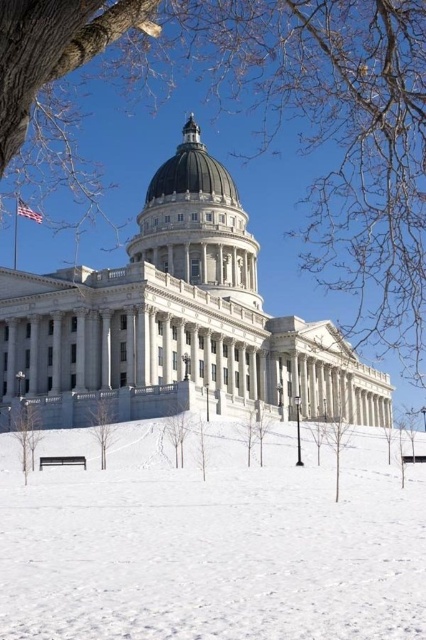
Question: Among these objects, which one is farthest from the camera?

Choices:
 (A) white powdery snow at center
 (B) smooth brown tree at center

Answer: (B)

Question: Can you confirm if green leafy tree at lower left is positioned to the right of smooth brown tree at center?

Choices:
 (A) no
 (B) yes

Answer: (A)

Question: Estimate the real-world distances between objects in this image. Which object is farther from the smooth brown tree at center?

Choices:
 (A) white powdery snow at center
 (B) bare branches at center
 (C) green leafy tree at center
 (D) matte gray dome at center

Answer: (D)

Question: Estimate the real-world distances between objects in this image. Which object is farther from the bare branches at center?

Choices:
 (A) green leafy tree at lower left
 (B) green leafy tree at center
 (C) matte gray dome at center

Answer: (C)

Question: Does matte gray dome at center appear over smooth brown tree at center?

Choices:
 (A) no
 (B) yes

Answer: (B)

Question: Can you confirm if green leafy tree at lower left is bigger than bare branches at center?

Choices:
 (A) yes
 (B) no

Answer: (B)